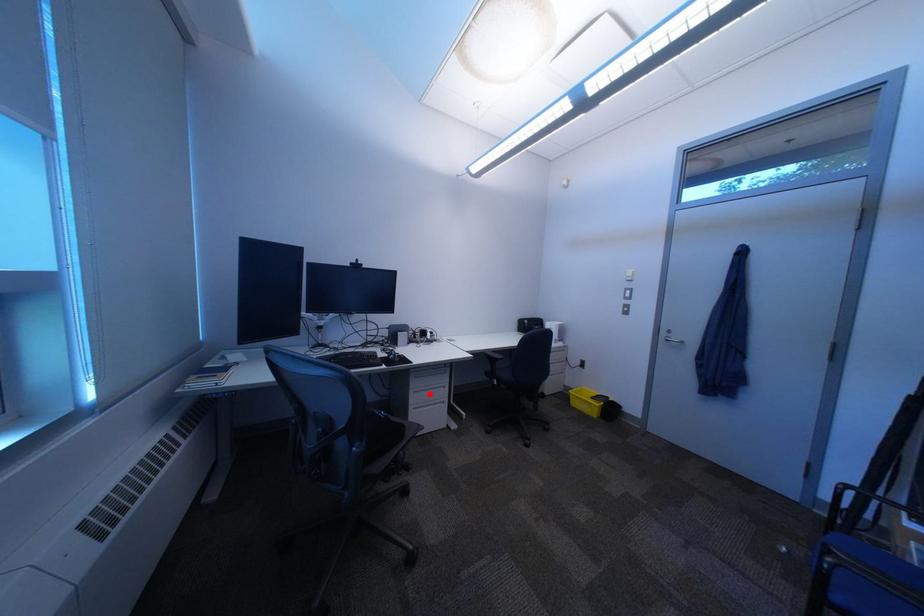
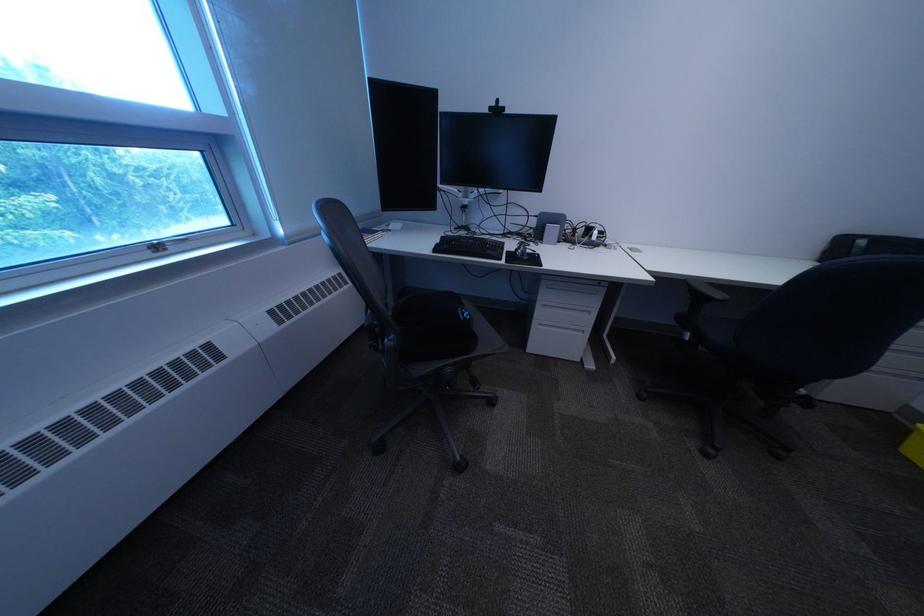
In the second image, find the point that corresponds to the highlighted location in the first image.

(558, 307)